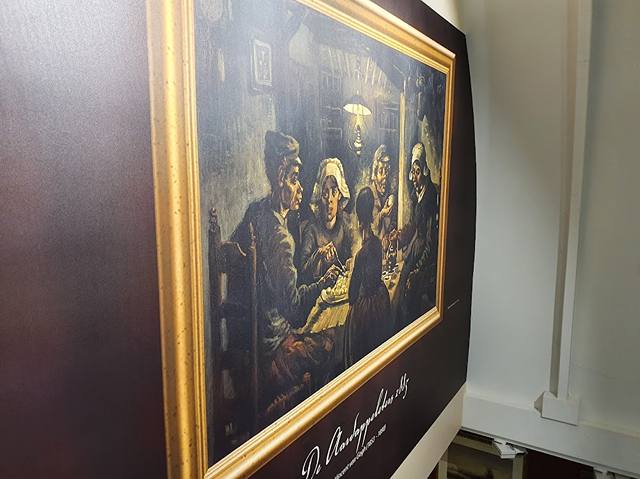
Identify the location of picture on painting. (260, 56).